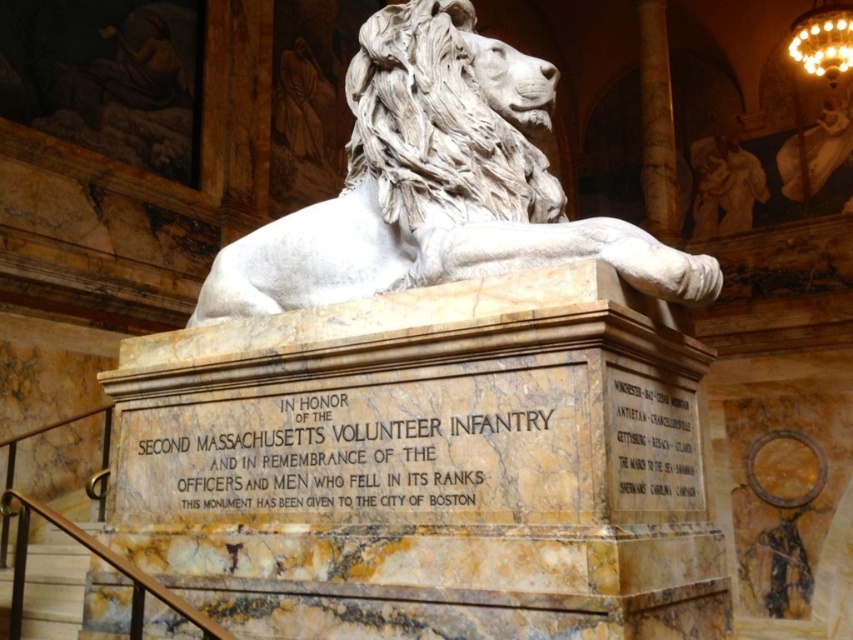
You are standing at the base of the grand marble monument and want to read the text on the black marble plaque at center. Considering the plaque is 14.03 meters away from you, can you read the text clearly without moving closer?

The black marble plaque at center is 14.03 meters from the viewer. At that distance, it would be difficult to read the text clearly without moving closer.

What is located at the point with coordinates (653, 444) in the image?

A gold metallic plaque at center is located at point (653, 444).

You are a historian examining the monument and want to read both the black marble plaque at center and the gold metallic plaque at center. Which plaque should you look at first to read the main inscription?

The gold metallic plaque at center is above the black marble plaque at center, so you should look at the gold metallic plaque at center first to read the main inscription.